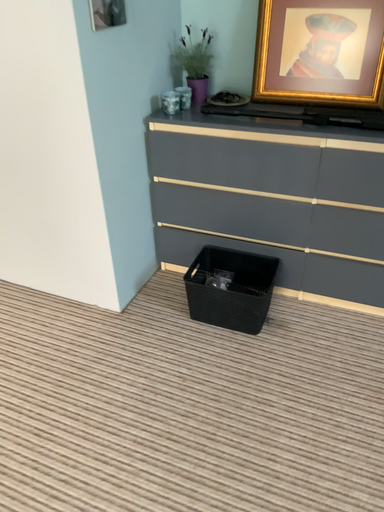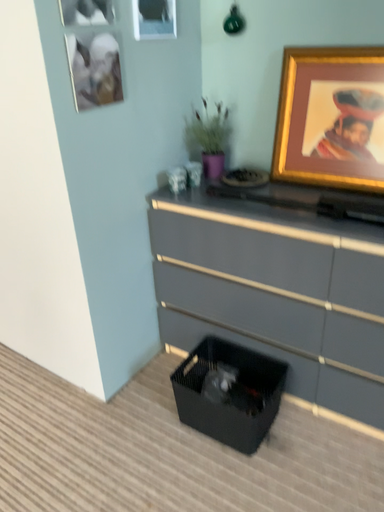
Question: How did the camera likely rotate when shooting the video?

Choices:
 (A) rotated right
 (B) rotated left

Answer: (B)